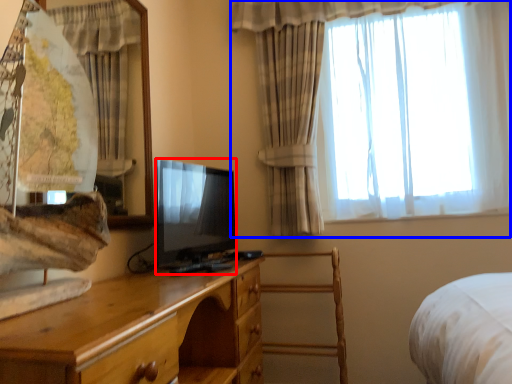
Question: Which object appears farthest to the camera in this image, television (highlighted by a red box) or curtain (highlighted by a blue box)?

Choices:
 (A) television
 (B) curtain

Answer: (B)